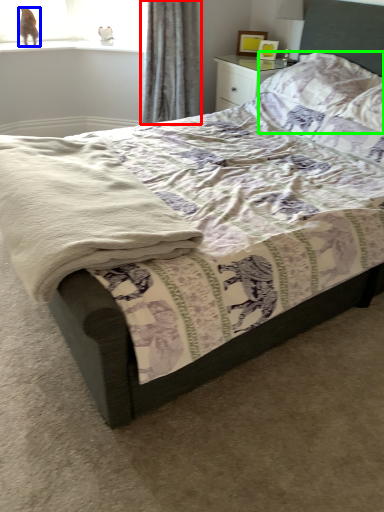
Question: Estimate the real-world distances between objects in this image. Which object is closer to curtain (highlighted by a red box), animal (highlighted by a blue box) or pillow (highlighted by a green box)?

Choices:
 (A) animal
 (B) pillow

Answer: (B)